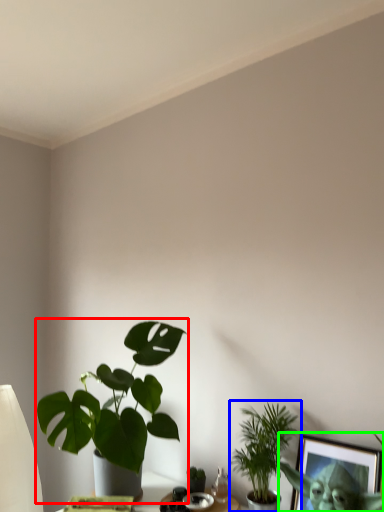
Question: Estimate the real-world distances between objects in this image. Which object is farther from houseplant (highlighted by a red box), houseplant (highlighted by a blue box) or picture frame (highlighted by a green box)?

Choices:
 (A) houseplant
 (B) picture frame

Answer: (B)